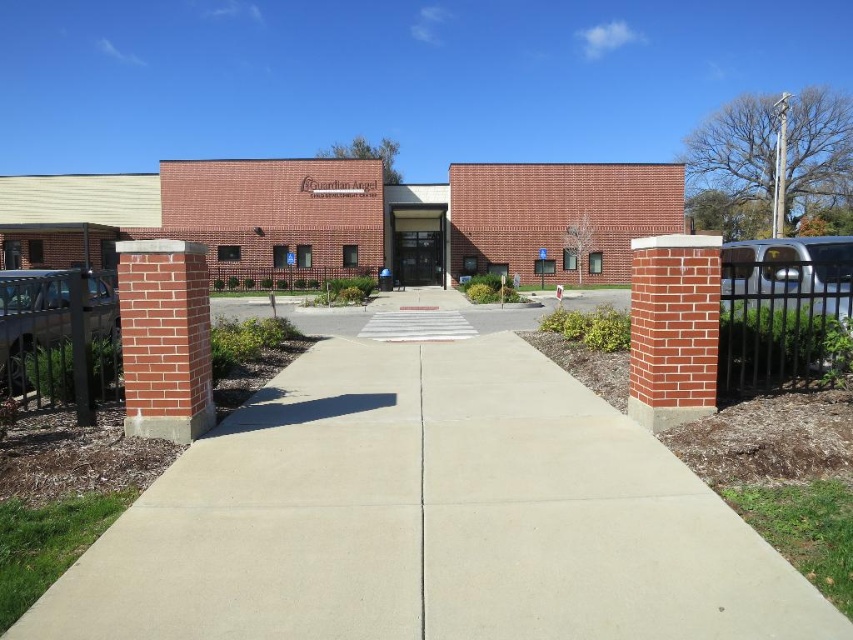
You are standing at the entrance of the Guardian Angel building and want to walk towards the concrete at center. Which direction should you go relative to the brick building at center?

The concrete at center is positioned on the right side of brick building at center, so you should walk towards the right side of the brick building at center to reach the concrete at center.

You are standing at the entrance of the Guardian Angel building and want to walk straight ahead towards the concrete at center. Based on the scene description, where would you be heading?

The concrete at center is located at point (428, 518), so you would be heading towards that coordinate.